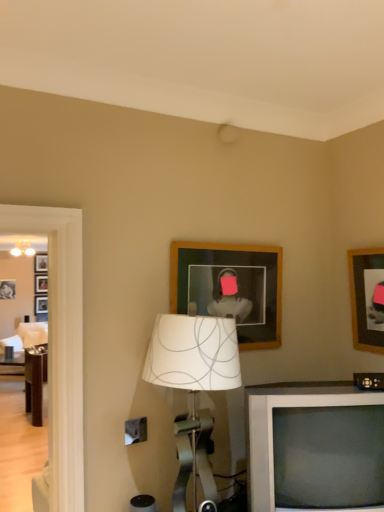
Question: Does wooden picture frame at upper right, arranged as the second picture frame when viewed from the left, lie in front of white fabric lampshade at center?

Choices:
 (A) no
 (B) yes

Answer: (A)

Question: Does wooden picture frame at upper right, arranged as the second picture frame when viewed from the left, come behind white fabric lampshade at center?

Choices:
 (A) yes
 (B) no

Answer: (A)

Question: Can you confirm if wooden picture frame at upper right, arranged as the first picture frame when viewed from the right, is positioned to the left of white fabric lampshade at center?

Choices:
 (A) no
 (B) yes

Answer: (A)

Question: Does wooden picture frame at upper right, arranged as the second picture frame when viewed from the left, contain white fabric lampshade at center?

Choices:
 (A) yes
 (B) no

Answer: (B)

Question: From a real-world perspective, is wooden picture frame at upper right, arranged as the second picture frame when viewed from the left, over white fabric lampshade at center?

Choices:
 (A) no
 (B) yes

Answer: (B)

Question: From a real-world perspective, is wooden picture frame at upper right, arranged as the first picture frame when viewed from the right, below white fabric lampshade at center?

Choices:
 (A) no
 (B) yes

Answer: (A)

Question: Considering the relative sizes of wooden picture frame at upper right, arranged as the first picture frame when viewed from the right, and wooden picture frame at upper center, acting as the 1th picture frame starting from the left, in the image provided, is wooden picture frame at upper right, arranged as the first picture frame when viewed from the right, bigger than wooden picture frame at upper center, acting as the 1th picture frame starting from the left,?

Choices:
 (A) yes
 (B) no

Answer: (B)

Question: From the image's perspective, is wooden picture frame at upper right, arranged as the first picture frame when viewed from the right, below wooden picture frame at upper center, acting as the 1th picture frame starting from the left?

Choices:
 (A) yes
 (B) no

Answer: (A)

Question: Considering the relative sizes of wooden picture frame at upper right, arranged as the second picture frame when viewed from the left, and wooden picture frame at upper center, acting as the 1th picture frame starting from the left, in the image provided, is wooden picture frame at upper right, arranged as the second picture frame when viewed from the left, shorter than wooden picture frame at upper center, acting as the 1th picture frame starting from the left,?

Choices:
 (A) yes
 (B) no

Answer: (B)

Question: Does wooden picture frame at upper right, arranged as the second picture frame when viewed from the left, have a greater height compared to wooden picture frame at upper center, acting as the 1th picture frame starting from the left?

Choices:
 (A) yes
 (B) no

Answer: (A)

Question: Would you consider wooden picture frame at upper right, arranged as the first picture frame when viewed from the right, to be distant from wooden picture frame at upper center, positioned as the 2th picture frame in right-to-left order?

Choices:
 (A) no
 (B) yes

Answer: (A)

Question: Can you confirm if wooden picture frame at upper right, arranged as the second picture frame when viewed from the left, is positioned to the left of wooden picture frame at upper center, acting as the 1th picture frame starting from the left?

Choices:
 (A) yes
 (B) no

Answer: (B)

Question: Does wooden picture frame at upper center, positioned as the 2th picture frame in right-to-left order, appear on the right side of wooden picture frame at upper right, arranged as the second picture frame when viewed from the left?

Choices:
 (A) no
 (B) yes

Answer: (A)